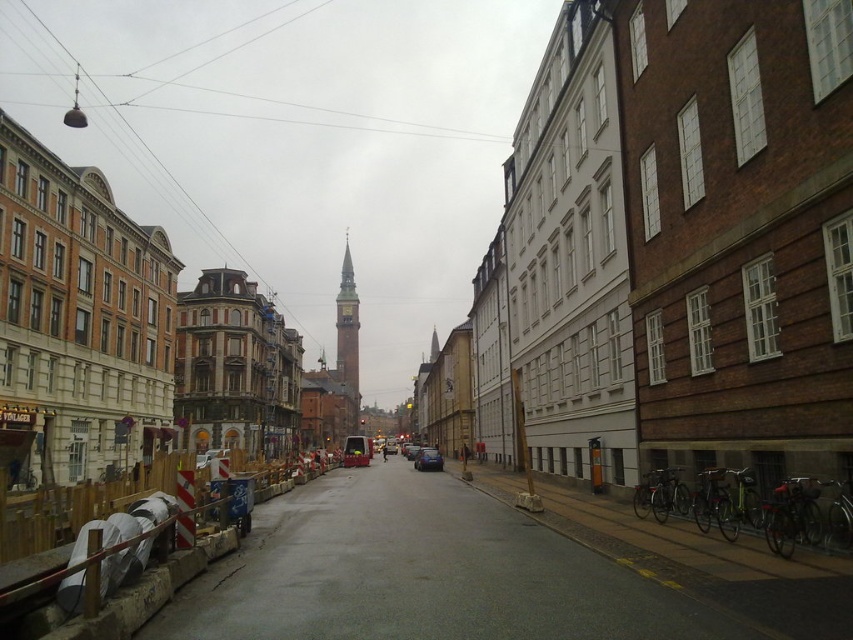
Question: Among these points, which one is nearest to the camera?

Choices:
 (A) (352, 412)
 (B) (421, 451)

Answer: (B)

Question: Is gold textured clock tower at center positioned at the back of metallic blue car at center?

Choices:
 (A) no
 (B) yes

Answer: (B)

Question: Which of the following is the closest to the observer?

Choices:
 (A) gold textured clock tower at center
 (B) metallic blue car at center

Answer: (B)

Question: Is gold textured clock tower at center to the right of metallic blue car at center from the viewer's perspective?

Choices:
 (A) no
 (B) yes

Answer: (A)

Question: From the image, what is the correct spatial relationship of gold textured clock tower at center in relation to metallic blue car at center?

Choices:
 (A) left
 (B) right

Answer: (A)